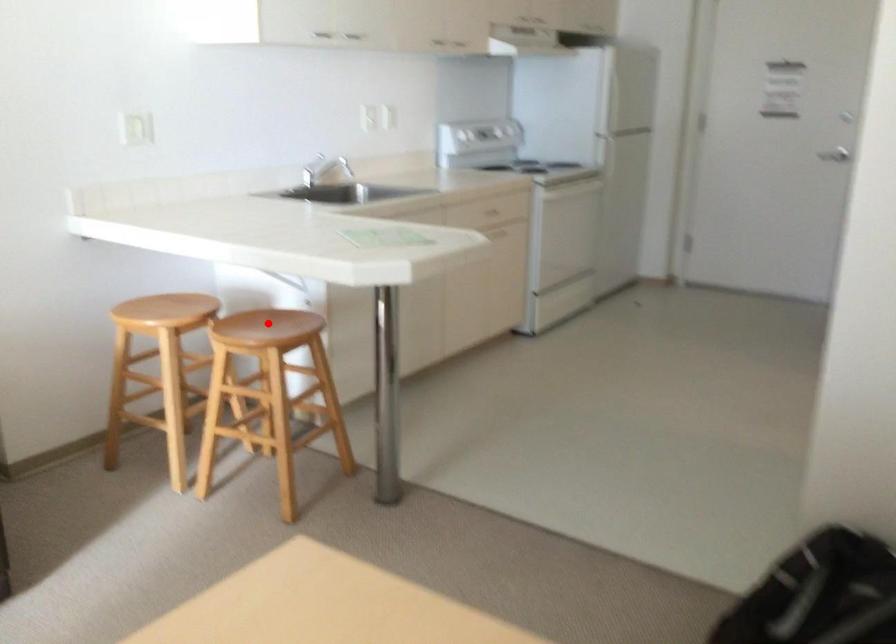
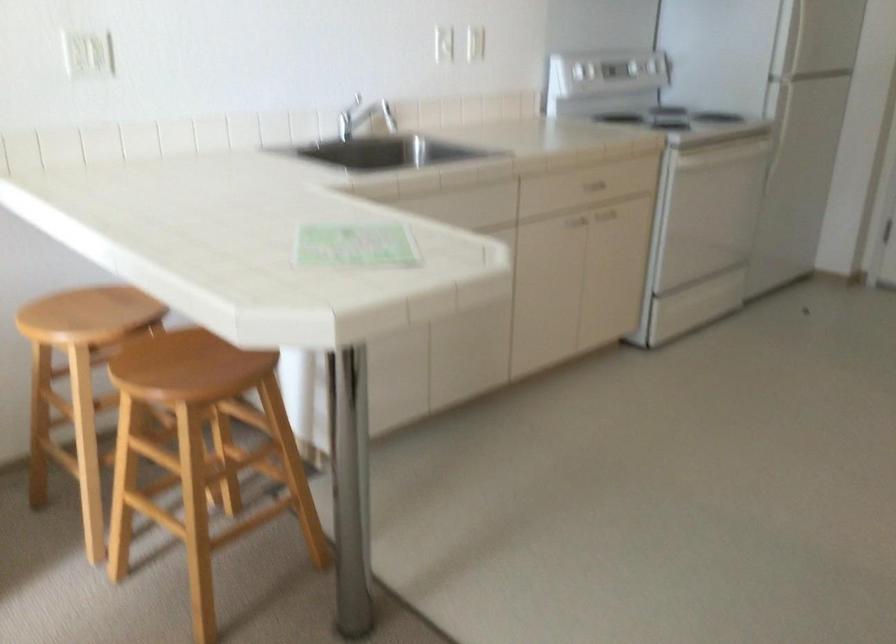
Question: I am providing you with two images of the same scene from different viewpoints. A red point is marked on the first image. At the location where the point appears in image 1, is it still visible in image 2?

Choices:
 (A) Yes
 (B) No

Answer: (A)